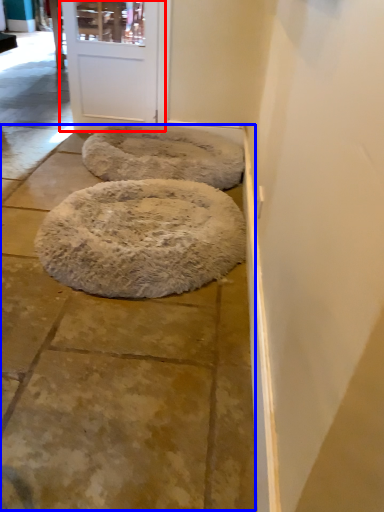
Question: Which object appears farthest to the camera in this image, door (highlighted by a red box) or pavement (highlighted by a blue box)?

Choices:
 (A) door
 (B) pavement

Answer: (A)